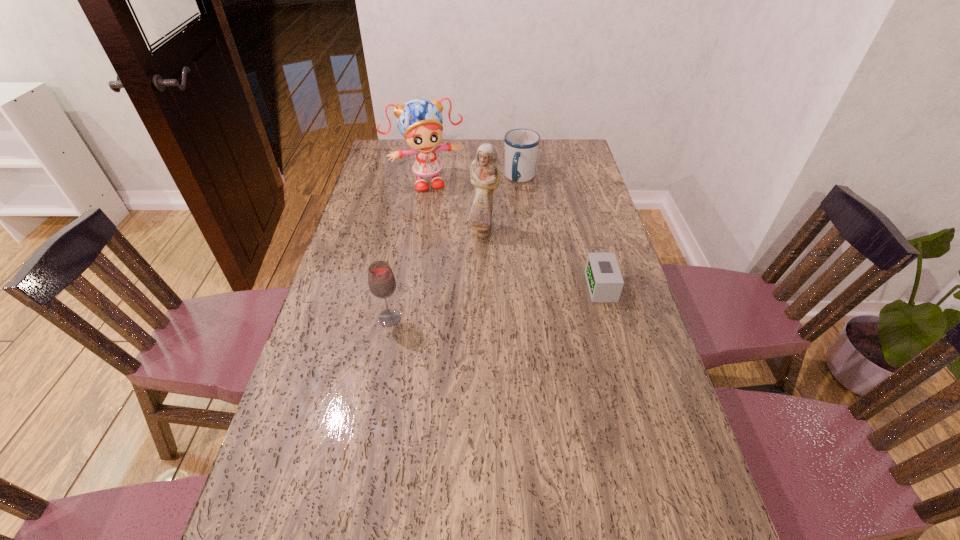
The width and height of the screenshot is (960, 540). Find the location of `the nearest object`. the nearest object is located at coordinates (381, 280).

Image resolution: width=960 pixels, height=540 pixels. I want to click on the fourth farthest object, so click(x=603, y=276).

At what (x,y) coordinates should I click in order to perform the action: click on the rightmost object. Please return your answer as a coordinate pair (x, y). This screenshot has width=960, height=540. Looking at the image, I should click on (603, 276).

At what (x,y) coordinates should I click in order to perform the action: click on doll. Please return your answer as a coordinate pair (x, y). This screenshot has width=960, height=540. Looking at the image, I should click on (419, 121).

Identify the location of the second object from right to left. (521, 145).

This screenshot has width=960, height=540. In order to click on the second shortest object in this screenshot , I will do `click(521, 145)`.

The height and width of the screenshot is (540, 960). In order to click on figurine in this screenshot , I will do `click(485, 172)`.

You are a GUI agent. You are given a task and a screenshot of the screen. Output one action in this format:
    pyautogui.click(x=<x>, y=<y>)
    Task: Click on the third object from left to right
    The width and height of the screenshot is (960, 540).
    Given the screenshot: What is the action you would take?
    pyautogui.click(x=485, y=172)

This screenshot has width=960, height=540. In order to click on vacant space located 0.190m on the front of the nearest object in this screenshot , I will do `click(375, 389)`.

Where is `free spot located 0.230m on the front-facing side of the alarm clock`? The height and width of the screenshot is (540, 960). free spot located 0.230m on the front-facing side of the alarm clock is located at coordinates (511, 287).